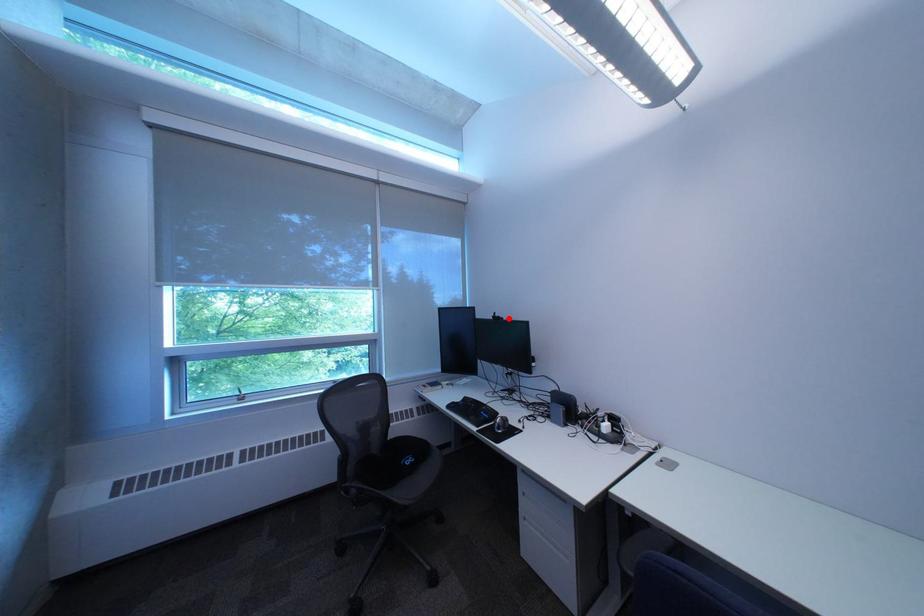
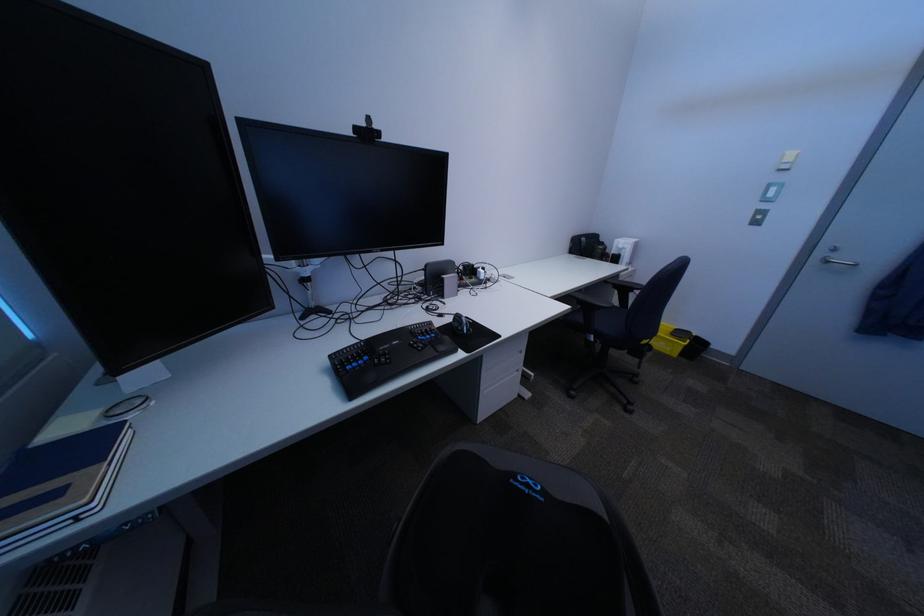
The point at the highlighted location is marked in the first image. Where is the corresponding point in the second image?

(371, 131)